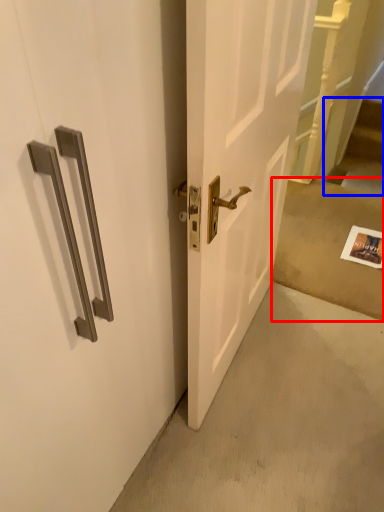
Question: Which object is further to the camera taking this photo, concrete (highlighted by a red box) or stairwell (highlighted by a blue box)?

Choices:
 (A) concrete
 (B) stairwell

Answer: (B)